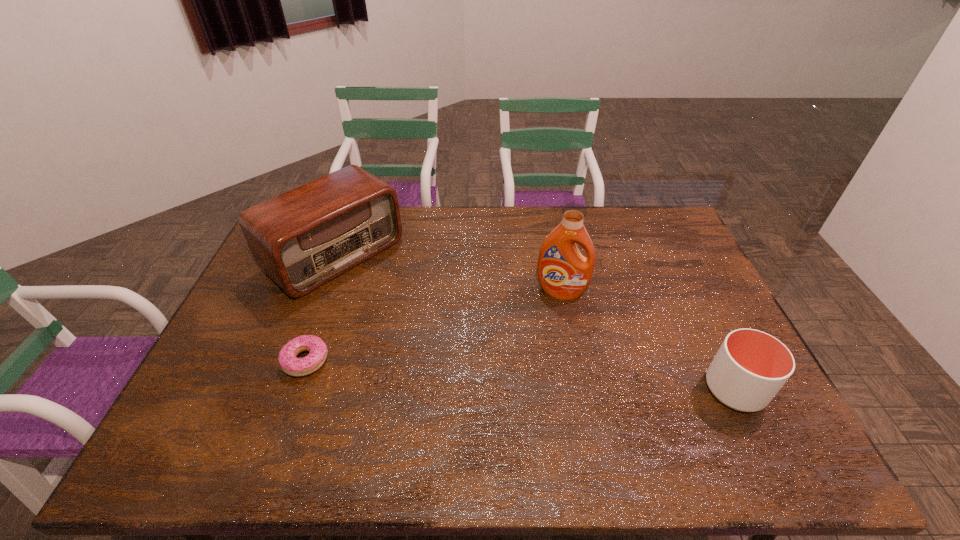
At what (x,y) coordinates should I click in order to perform the action: click on doughnut. Please return your answer as a coordinate pair (x, y). The width and height of the screenshot is (960, 540). Looking at the image, I should click on (289, 363).

This screenshot has width=960, height=540. Identify the location of the rightmost object. (751, 366).

I want to click on the third tallest object, so click(x=751, y=366).

The image size is (960, 540). Find the location of `the second object from right to left`. the second object from right to left is located at coordinates (563, 272).

The height and width of the screenshot is (540, 960). In order to click on the tallest object in this screenshot , I will do `click(563, 272)`.

Where is `the second tallest object`? Image resolution: width=960 pixels, height=540 pixels. the second tallest object is located at coordinates (303, 238).

This screenshot has height=540, width=960. I want to click on vacant area situated on the back of the doughnut, so click(x=320, y=321).

Where is `vacant space located on the left of the cup`? vacant space located on the left of the cup is located at coordinates (666, 389).

Where is `free space located on the front-facing side of the detergent`? free space located on the front-facing side of the detergent is located at coordinates pos(550,327).

Where is `free space located on the front-facing side of the detergent`? The width and height of the screenshot is (960, 540). free space located on the front-facing side of the detergent is located at coordinates (545, 350).